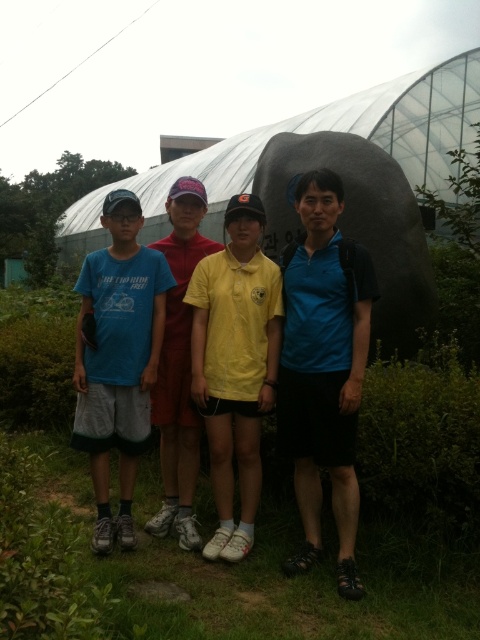
From the picture: You are a photographer trying to focus on the blue fabric shirt at right in the image. What are the coordinates where you should aim your camera?

The blue fabric shirt at right is located at coordinates (324, 368).